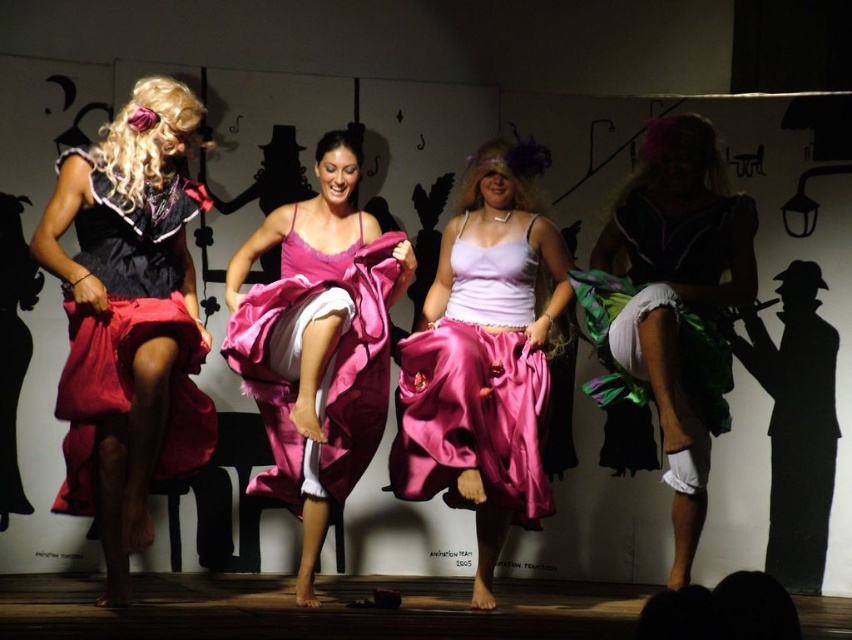
Does pink satin skirt at center have a larger size compared to satin pink dress at center?

Actually, pink satin skirt at center might be smaller than satin pink dress at center.

Which is more to the right, pink satin skirt at center or satin pink dress at center?

From the viewer's perspective, pink satin skirt at center appears more on the right side.

Is point (532, 490) closer to viewer compared to point (380, 323)?

Yes, it is in front of point (380, 323).

I want to click on pink satin skirt at center, so click(476, 388).

Between matte black dress at left and pink satin skirt at center, which one is positioned lower?

pink satin skirt at center is lower down.

Is matte black dress at left shorter than pink satin skirt at center?

No, matte black dress at left is not shorter than pink satin skirt at center.

This screenshot has height=640, width=852. What are the coordinates of `matte black dress at left` in the screenshot? It's located at (130, 320).

Where is `matte black dress at left`? This screenshot has height=640, width=852. matte black dress at left is located at coordinates (130, 320).

Can you confirm if matte black dress at right is smaller than pink satin skirt at center?

Actually, matte black dress at right might be larger than pink satin skirt at center.

Is matte black dress at right wider than pink satin skirt at center?

Indeed, matte black dress at right has a greater width compared to pink satin skirt at center.

The width and height of the screenshot is (852, 640). I want to click on matte black dress at right, so click(x=680, y=301).

Where is `matte black dress at right`? matte black dress at right is located at coordinates (680, 301).